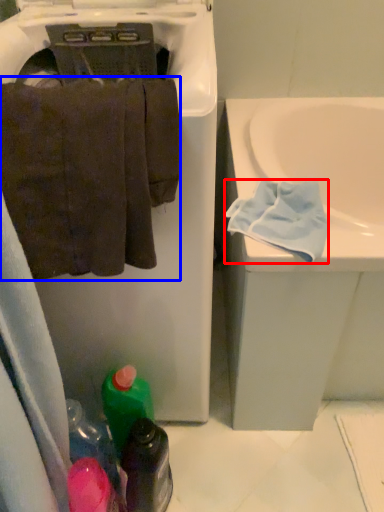
Question: Among these objects, which one is farthest to the camera, bath towel (highlighted by a red box) or towel (highlighted by a blue box)?

Choices:
 (A) bath towel
 (B) towel

Answer: (A)